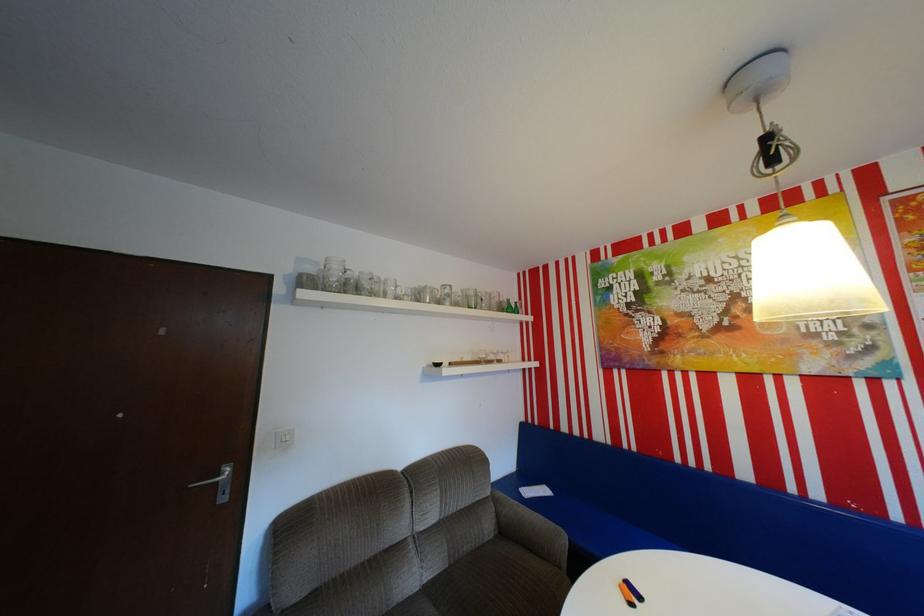
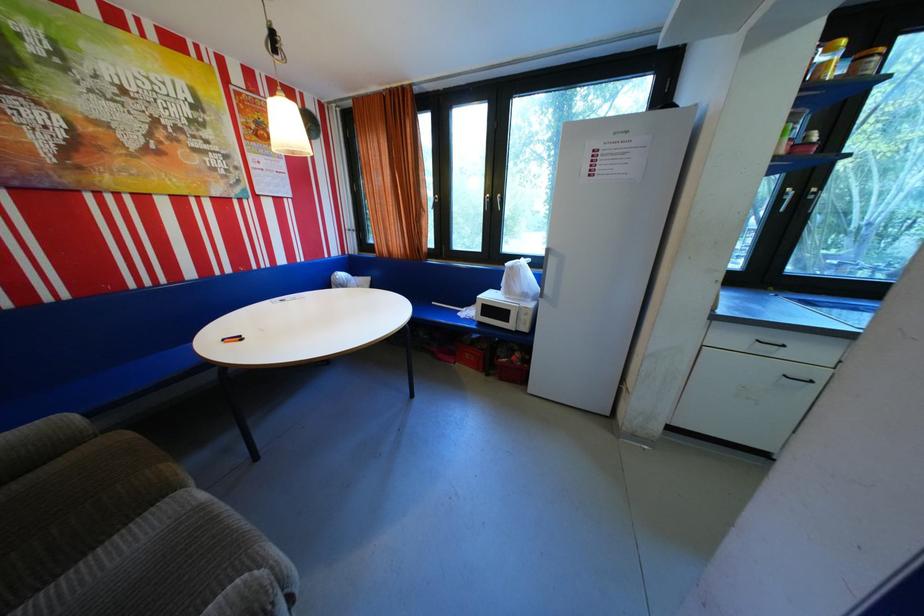
The point at (573,537) is marked in the first image. Where is the corresponding point in the second image?

(79, 418)